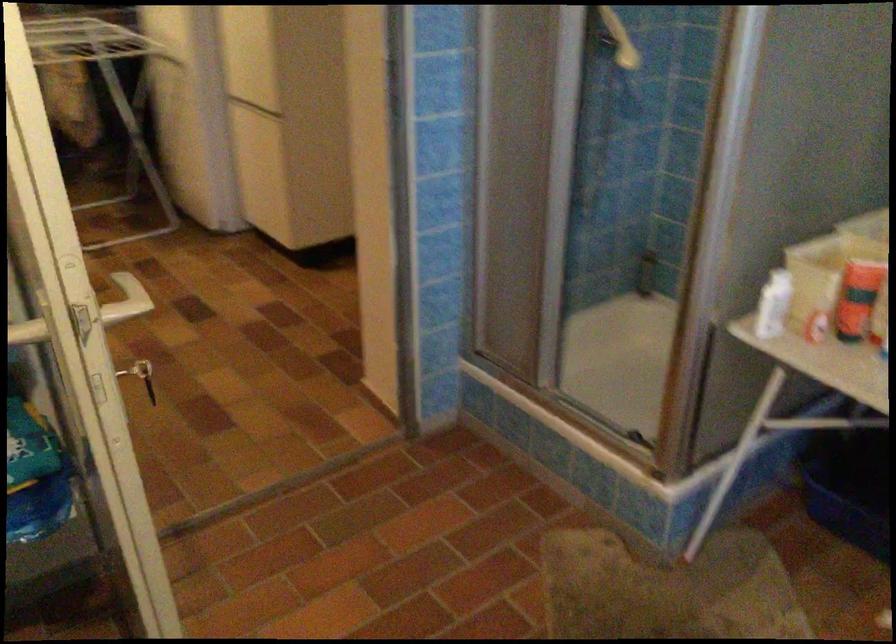
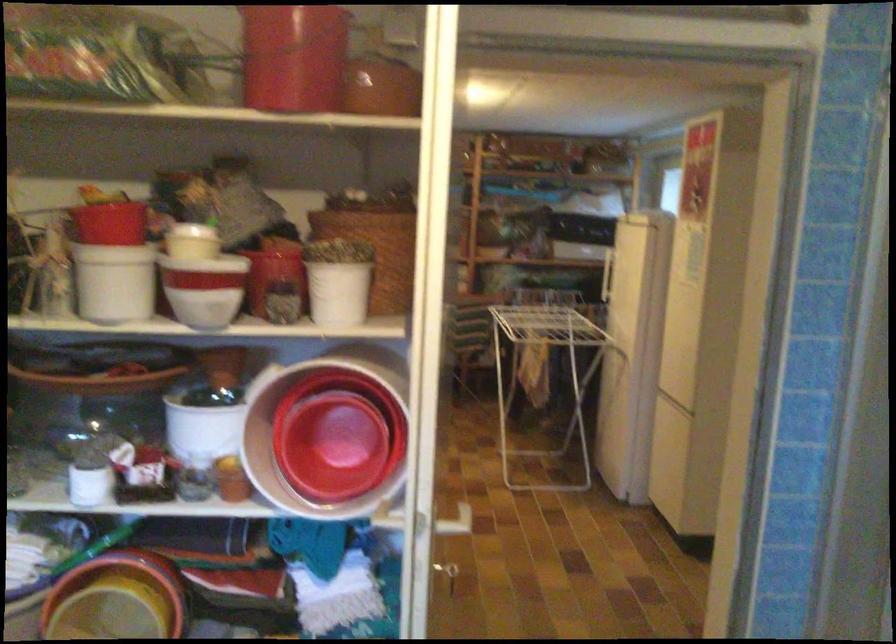
In the second image, find the point that corresponds to [99,124] in the first image.

(545, 375)